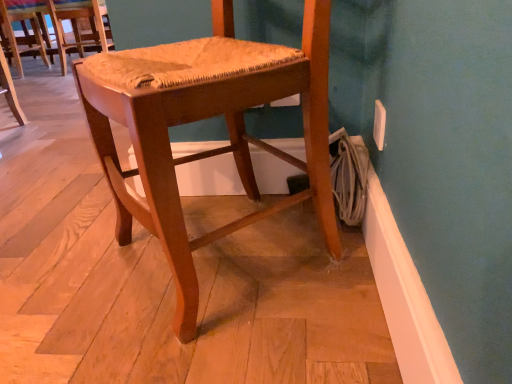
Question: Can you confirm if wooden woven seat at center, which is the 2th chair from back to front, is taller than woven wood chair at center, which ranks as the 2th chair in front-to-back order?

Choices:
 (A) yes
 (B) no

Answer: (A)

Question: Is wooden woven seat at center, which is the 2th chair from back to front, shorter than woven wood chair at center, which appears as the 2th chair when viewed from the right?

Choices:
 (A) no
 (B) yes

Answer: (A)

Question: Is wooden woven seat at center, the 2th chair from the left, in contact with woven wood chair at center, which is counted as the 1th chair, starting from the top?

Choices:
 (A) yes
 (B) no

Answer: (B)

Question: Can you confirm if wooden woven seat at center, marked as the second chair in a top-to-bottom arrangement, is positioned to the right of woven wood chair at center, which is counted as the 1th chair, starting from the back?

Choices:
 (A) yes
 (B) no

Answer: (A)

Question: Considering the relative sizes of wooden woven seat at center, marked as the second chair in a top-to-bottom arrangement, and woven wood chair at center, which is counted as the 1th chair, starting from the back, in the image provided, is wooden woven seat at center, marked as the second chair in a top-to-bottom arrangement, thinner than woven wood chair at center, which is counted as the 1th chair, starting from the back,?

Choices:
 (A) yes
 (B) no

Answer: (B)

Question: From the image's perspective, would you say wooden woven seat at center, marked as the second chair in a top-to-bottom arrangement, is shown under woven wood chair at center, which appears as the 2th chair when viewed from the right?

Choices:
 (A) no
 (B) yes

Answer: (B)

Question: Is the depth of woven wood chair at center, which is counted as the 1th chair, starting from the back, less than that of wooden woven seat at center, the 2th chair from the left?

Choices:
 (A) yes
 (B) no

Answer: (B)

Question: Considering the relative positions of woven wood chair at center, which ranks as the 2th chair in front-to-back order, and wooden woven seat at center, marked as the second chair in a top-to-bottom arrangement, in the image provided, is woven wood chair at center, which ranks as the 2th chair in front-to-back order, to the left of wooden woven seat at center, marked as the second chair in a top-to-bottom arrangement, from the viewer's perspective?

Choices:
 (A) no
 (B) yes

Answer: (B)

Question: Is woven wood chair at center, which ranks as the 2th chair in front-to-back order, far away from wooden woven seat at center, marked as the 1th chair in a front-to-back arrangement?

Choices:
 (A) yes
 (B) no

Answer: (A)

Question: Is woven wood chair at center, which is counted as the 1th chair, starting from the back, at the right side of wooden woven seat at center, the 1th chair in the right-to-left sequence?

Choices:
 (A) no
 (B) yes

Answer: (A)

Question: Is woven wood chair at center, which is counted as the 1th chair, starting from the top, bigger than wooden woven seat at center, the first chair when ordered from bottom to top?

Choices:
 (A) yes
 (B) no

Answer: (B)

Question: Is woven wood chair at center, which is counted as the 1th chair, starting from the top, looking in the opposite direction of wooden woven seat at center, marked as the second chair in a top-to-bottom arrangement?

Choices:
 (A) yes
 (B) no

Answer: (B)

Question: Is wooden woven seat at center, marked as the second chair in a top-to-bottom arrangement, inside or outside of woven wood chair at center, which appears as the 2th chair when viewed from the right?

Choices:
 (A) outside
 (B) inside

Answer: (A)